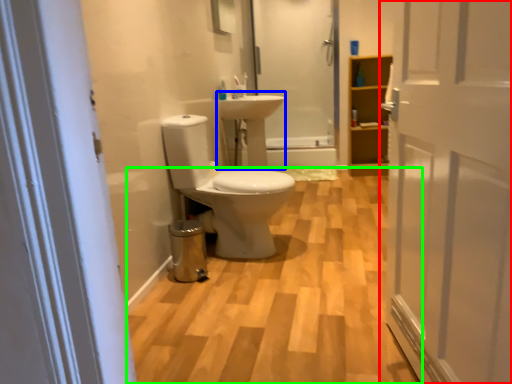
Question: Estimate the real-world distances between objects in this image. Which object is closer to door (highlighted by a red box), sink (highlighted by a blue box) or plain (highlighted by a green box)?

Choices:
 (A) sink
 (B) plain

Answer: (B)